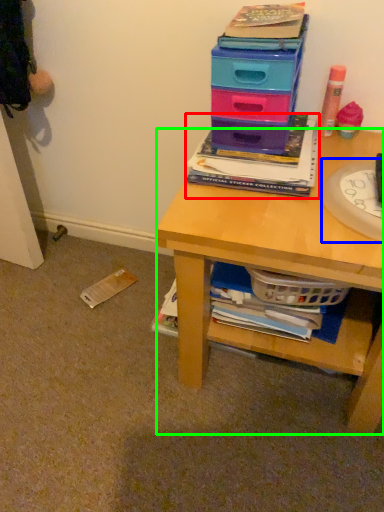
Question: Considering the real-world distances, which object is farthest from book (highlighted by a red box)? paper plate (highlighted by a blue box) or desk (highlighted by a green box)?

Choices:
 (A) paper plate
 (B) desk

Answer: (B)